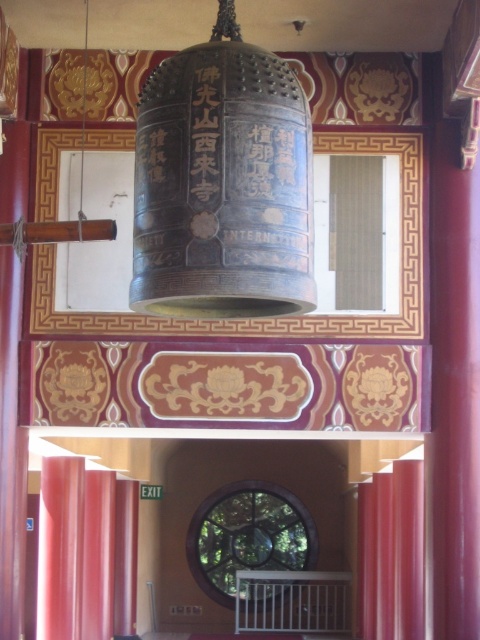
You are standing in front of the large ornate bell in the traditional East Asian architectural setting. There are two points marked on the bell, one at coordinates point (x=83, y=490) and the other at point (x=359, y=556). Which point is closer to you?

Point (x=83, y=490) is closer to the viewer than point (x=359, y=556).

You are a visitor in this temple and want to walk from the entrance to the bell. The entrance is at the lower left corner of the image. There are two matte red curtains in your path. How far apart are the two matte red curtain at lower left and the matte red curtain at right?

The two matte red curtains are 5.66 meters apart from each other.

You are a visitor standing in the temple and want to see the bell clearly. There are two matte red curtains in your view. Which curtain, the matte red curtain at lower left or the matte red curtain at right, is closer to you?

The matte red curtain at lower left is closer to you because it is positioned over the matte red curtain at right.